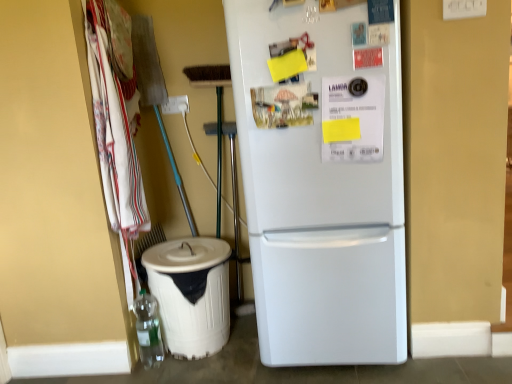
What do you see at coordinates (148, 329) in the screenshot? The height and width of the screenshot is (384, 512). I see `translucent plastic bottle at lower left` at bounding box center [148, 329].

The image size is (512, 384). What do you see at coordinates (114, 141) in the screenshot?
I see `white cotton towels at left` at bounding box center [114, 141].

Locate an element on the screen. white plastic recycling bin at lower left is located at coordinates click(x=191, y=293).

Between white plastic recycling bin at lower left and white matte refrigerator at center, which one has more height?

With more height is white matte refrigerator at center.

From the image's perspective, would you say white plastic recycling bin at lower left is shown under white matte refrigerator at center?

Yes.

Based on the photo, considering the relative sizes of white plastic recycling bin at lower left and white matte refrigerator at center in the image provided, is white plastic recycling bin at lower left wider than white matte refrigerator at center?

No.

In terms of width, does white cotton towels at left look wider or thinner when compared to translucent plastic bottle at lower left?

Clearly, white cotton towels at left has more width compared to translucent plastic bottle at lower left.

Is white cotton towels at left bigger than translucent plastic bottle at lower left?

Yes, white cotton towels at left is bigger than translucent plastic bottle at lower left.

Locate an element on the screen. laundry above the translucent plastic bottle at lower left (from the image's perspective) is located at coordinates (114, 141).

Considering the relative sizes of white cotton towels at left and white plastic recycling bin at lower left in the image provided, is white cotton towels at left smaller than white plastic recycling bin at lower left?

Yes.

In terms of width, does white cotton towels at left look wider or thinner when compared to white plastic recycling bin at lower left?

Clearly, white cotton towels at left has less width compared to white plastic recycling bin at lower left.

Is white cotton towels at left with white plastic recycling bin at lower left?

They are not placed beside each other.

Considering the positions of objects white cotton towels at left and white plastic recycling bin at lower left in the image provided, who is behind, white cotton towels at left or white plastic recycling bin at lower left?

Positioned behind is white plastic recycling bin at lower left.

In order to click on refrigerator in front of the translucent plastic bottle at lower left in this screenshot , I will do click(x=320, y=203).

Is white matte refrigerator at center outside of translucent plastic bottle at lower left?

Yes.

From a real-world perspective, which is physically below, white matte refrigerator at center or translucent plastic bottle at lower left?

In real-world perspective, translucent plastic bottle at lower left is lower.

Can you confirm if white matte refrigerator at center is positioned to the left of translucent plastic bottle at lower left?

No, white matte refrigerator at center is not to the left of translucent plastic bottle at lower left.

Can you see white matte refrigerator at center touching white plastic recycling bin at lower left?

white matte refrigerator at center and white plastic recycling bin at lower left are not in contact.

Does point (298, 243) come farther from viewer compared to point (185, 260)?

No, it is not.

Does white matte refrigerator at center have a greater height compared to white plastic recycling bin at lower left?

Yes.

Is translucent plastic bottle at lower left far from white cotton towels at left?

translucent plastic bottle at lower left is near white cotton towels at left, not far away.

From the image's perspective, which one is positioned higher, translucent plastic bottle at lower left or white cotton towels at left?

white cotton towels at left appears higher in the image.

Which of these two, translucent plastic bottle at lower left or white cotton towels at left, stands taller?

white cotton towels at left is taller.

Which object is positioned more to the right, white cotton towels at left or white matte refrigerator at center?

white matte refrigerator at center is more to the right.

Considering the points (121, 107) and (319, 306), which point is behind, point (121, 107) or point (319, 306)?

The point (121, 107) is farther.

From a real-world perspective, does white cotton towels at left sit lower than white matte refrigerator at center?

No, from a real-world perspective, white cotton towels at left is not under white matte refrigerator at center.

Between white cotton towels at left and white matte refrigerator at center, which one has larger size?

white matte refrigerator at center.

Image resolution: width=512 pixels, height=384 pixels. I want to click on refrigerator above the white plastic recycling bin at lower left (from the image's perspective), so click(x=320, y=203).

Image resolution: width=512 pixels, height=384 pixels. I want to click on bottle behind the white cotton towels at left, so click(x=148, y=329).

Considering their positions, is white plastic recycling bin at lower left positioned further to white cotton towels at left than white matte refrigerator at center?

Among the two, white matte refrigerator at center is located further to white cotton towels at left.

Considering their positions, is white matte refrigerator at center positioned further to white cotton towels at left than white plastic recycling bin at lower left?

white matte refrigerator at center.

From the image, which object appears to be farther from translucent plastic bottle at lower left, white matte refrigerator at center or white plastic recycling bin at lower left?

The object further to translucent plastic bottle at lower left is white matte refrigerator at center.

When comparing their distances from white matte refrigerator at center, does white plastic recycling bin at lower left or translucent plastic bottle at lower left seem closer?

white plastic recycling bin at lower left.

From the picture: Looking at the image, which one is located further to white cotton towels at left, translucent plastic bottle at lower left or white plastic recycling bin at lower left?

Based on the image, translucent plastic bottle at lower left appears to be further to white cotton towels at left.

Based on their spatial positions, is translucent plastic bottle at lower left or white cotton towels at left closer to white plastic recycling bin at lower left?

translucent plastic bottle at lower left lies closer to white plastic recycling bin at lower left than the other object.

Based on their spatial positions, is white matte refrigerator at center or translucent plastic bottle at lower left closer to white plastic recycling bin at lower left?

Among the two, translucent plastic bottle at lower left is located nearer to white plastic recycling bin at lower left.

Which object lies nearer to the anchor point translucent plastic bottle at lower left, white plastic recycling bin at lower left or white cotton towels at left?

white plastic recycling bin at lower left is positioned closer to the anchor translucent plastic bottle at lower left.

Identify the location of recycling bin situated between white cotton towels at left and white matte refrigerator at center from left to right. The width and height of the screenshot is (512, 384). coord(191,293).

I want to click on bottle situated between white cotton towels at left and white matte refrigerator at center from left to right, so click(148, 329).

Image resolution: width=512 pixels, height=384 pixels. Identify the location of recycling bin between translucent plastic bottle at lower left and white matte refrigerator at center. coord(191,293).

At what (x,y) coordinates should I click in order to perform the action: click on recycling bin between white cotton towels at left and translucent plastic bottle at lower left in the up-down direction. Please return your answer as a coordinate pair (x, y). This screenshot has width=512, height=384. Looking at the image, I should click on (191, 293).